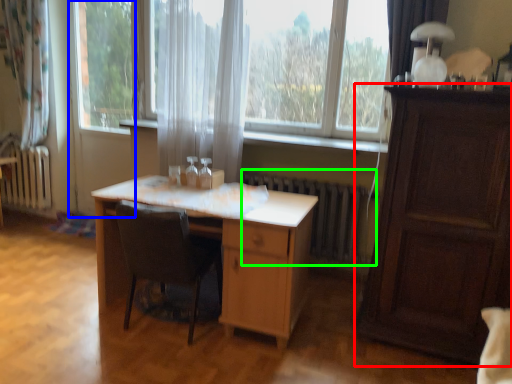
Question: Considering the real-world distances, which object is closest to cabinetry (highlighted by a red box)? screen door (highlighted by a blue box) or radiator (highlighted by a green box).

Choices:
 (A) screen door
 (B) radiator

Answer: (B)